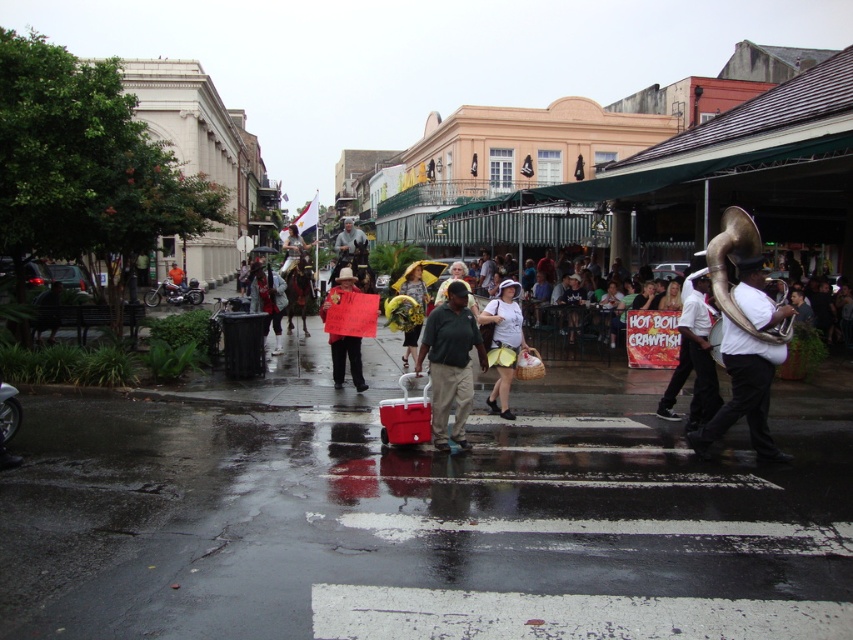
Question: Among these objects, which one is farthest from the camera?

Choices:
 (A) matte black sign at center
 (B) green cotton shirt at center
 (C) matte black jacket at center
 (D) smooth asphalt pavement at center

Answer: (C)

Question: Can you confirm if smooth asphalt pavement at center is positioned to the left of shiny silver tuba at right?

Choices:
 (A) no
 (B) yes

Answer: (B)

Question: Which object is farther from the camera taking this photo?

Choices:
 (A) matte black sign at center
 (B) white cotton dress at center

Answer: (A)

Question: Does white cotton dress at center lie in front of red fabric sign at center?

Choices:
 (A) yes
 (B) no

Answer: (A)

Question: Observing the image, what is the correct spatial positioning of yellow fabric umbrella at center in reference to red fabric sign at center?

Choices:
 (A) left
 (B) right

Answer: (B)

Question: Which of the following is the closest to the observer?

Choices:
 (A) (277, 321)
 (B) (334, 244)

Answer: (A)